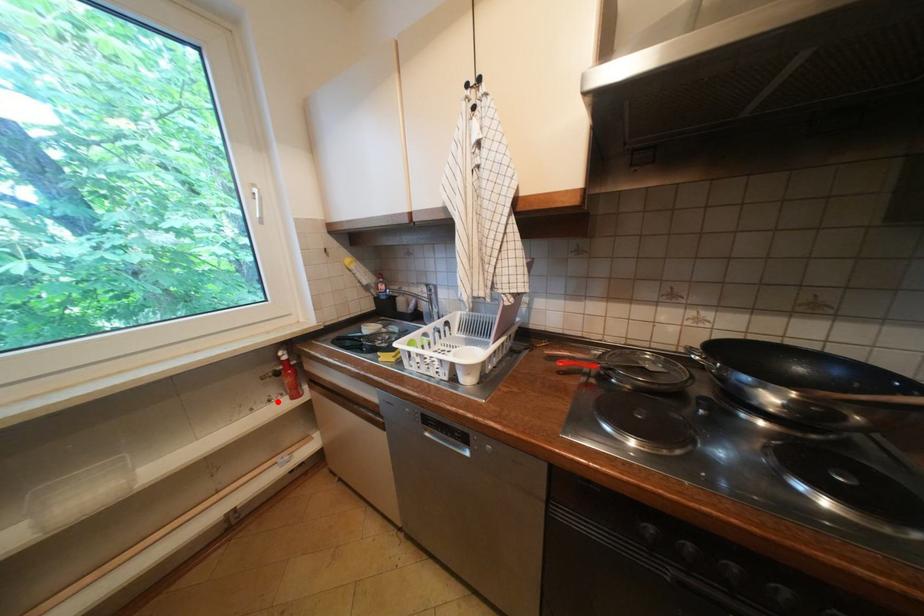
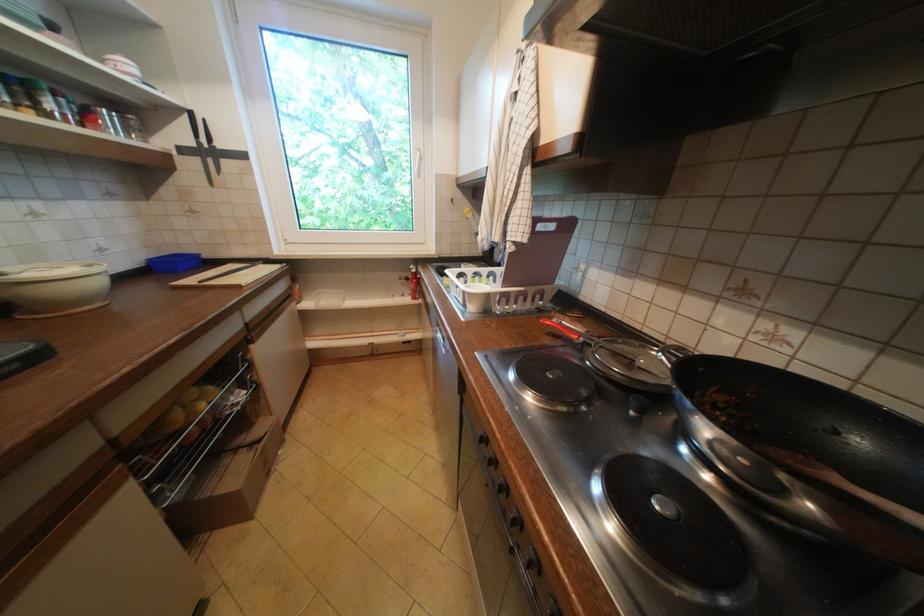
Where in the second image is the point corresponding to the highlighted location from the first image?

(410, 296)